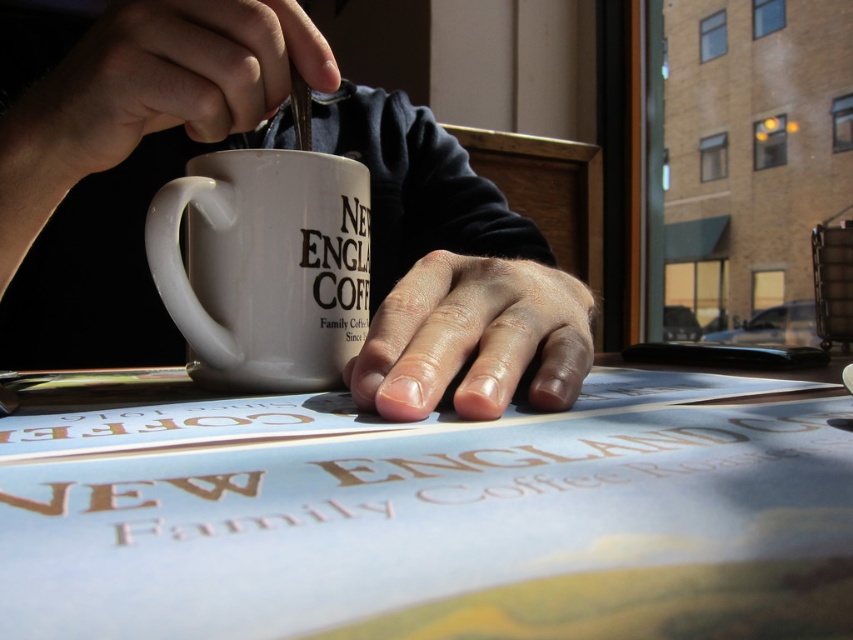
You are a barista observing a customer at the counter. You notice the smooth skin hand at upper left and the white ceramic mug at center. Which object is closer to you, the observer?

The smooth skin hand at upper left is closer to you because it is positioned behind the white ceramic mug at center, meaning the hand is in front of the mug from your perspective.

You are a barista observing the smooth skin hand at upper left and the dry skin at center. Which hand is closer to you?

The smooth skin hand at upper left is closer to you because it is further to the viewer than the dry skin at center.